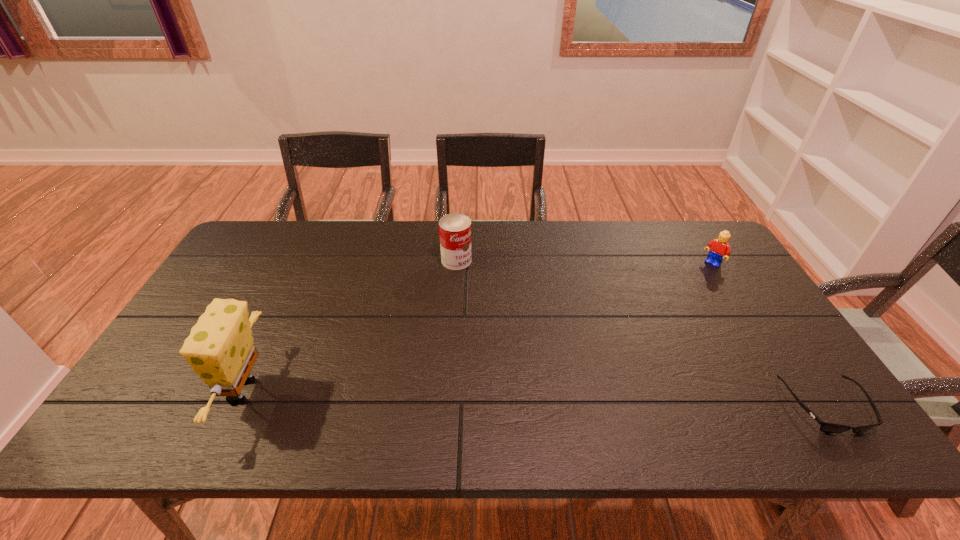
You are a GUI agent. You are given a task and a screenshot of the screen. Output one action in this format:
    pyautogui.click(x=<x>, y=<y>)
    Task: Click on the vacant space located on the front label of the second tallest object
    The width and height of the screenshot is (960, 540).
    Given the screenshot: What is the action you would take?
    pyautogui.click(x=484, y=286)

Locate an element on the screen. Image resolution: width=960 pixels, height=540 pixels. vacant space located 0.110m on the front label of the second tallest object is located at coordinates [x=486, y=287].

Locate an element on the screen. vacant space located 0.120m on the front-facing side of the second shortest object is located at coordinates (688, 286).

Locate an element on the screen. vacant area located on the front-facing side of the second shortest object is located at coordinates pyautogui.click(x=680, y=293).

Find the location of `free space located 0.280m on the front-facing side of the second shortest object`. free space located 0.280m on the front-facing side of the second shortest object is located at coordinates pos(660,311).

Where is `can that is positioned at the far edge`? can that is positioned at the far edge is located at coordinates (454, 229).

Locate an element on the screen. The image size is (960, 540). Lego located in the far edge section of the desktop is located at coordinates (719, 248).

Locate an element on the screen. The image size is (960, 540). sponge that is at the near edge is located at coordinates (220, 348).

Find the location of `sunglasses at the near edge`. sunglasses at the near edge is located at coordinates (825, 427).

Identify the location of sunglasses at the right edge. The width and height of the screenshot is (960, 540). pyautogui.click(x=825, y=427).